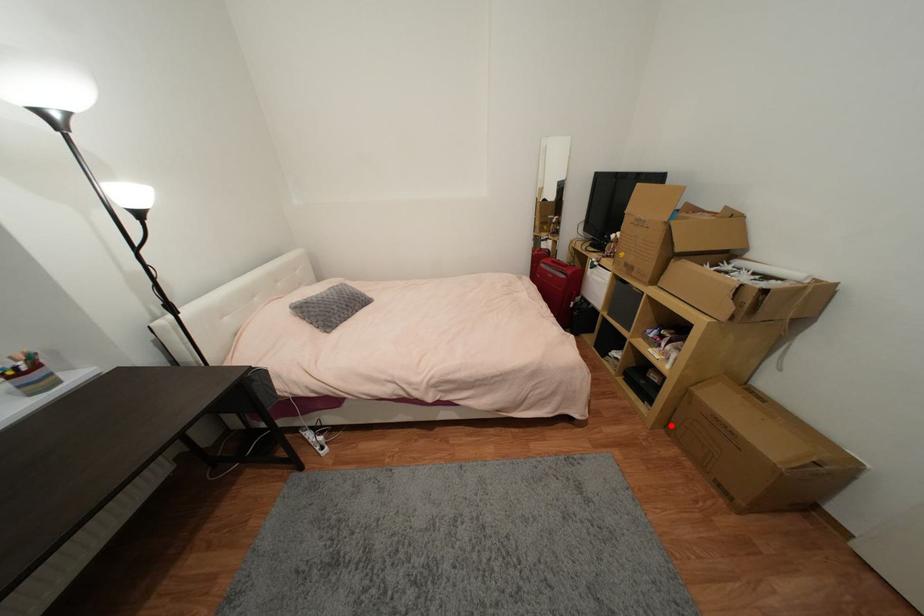
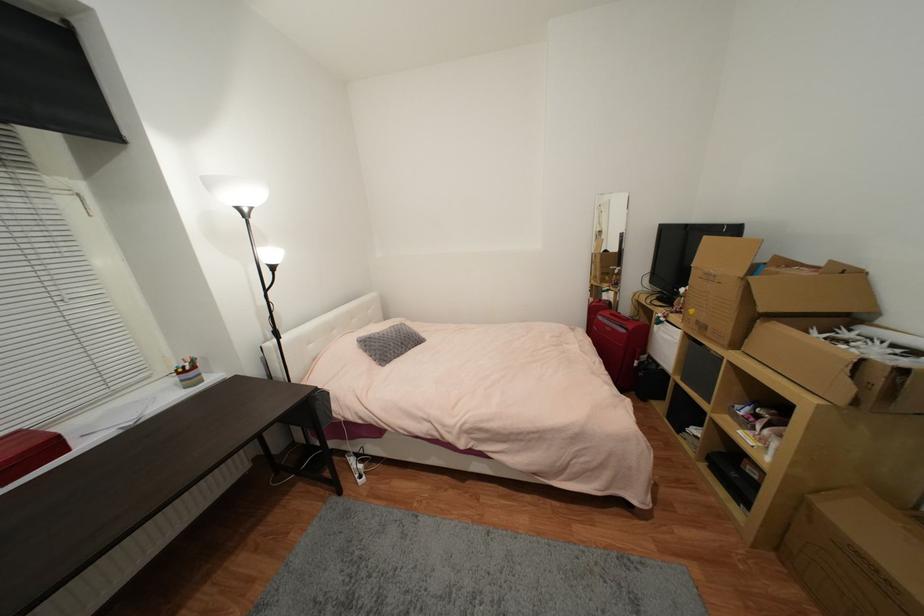
Question: I am providing you with two images of the same scene from different viewpoints. Image1 has a red point marked. In image2, the corresponding 3D location appears at what relative position? Reply with the corresponding letter.

Choices:
 (A) Closer
 (B) Farther

Answer: (B)